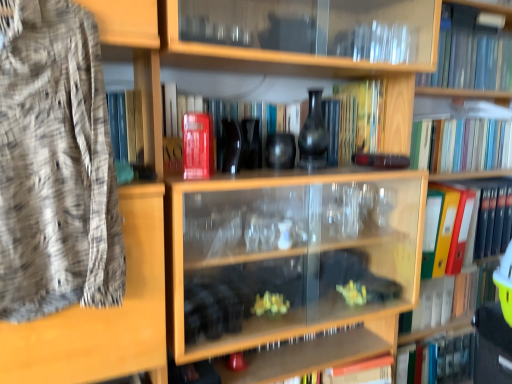
Question: Based on their positions, is yellow plastic folder at right, which is the 1th book in bottom-to-top order, located to the left or right of matte red book at center, which ranks as the 4th book in top-to-bottom order?

Choices:
 (A) right
 (B) left

Answer: (A)

Question: Is point (444, 307) closer or farther from the camera than point (163, 107)?

Choices:
 (A) closer
 (B) farther

Answer: (B)

Question: Estimate the real-world distances between objects in this image. Which object is farther from the transparent glass cabinet at lower center?

Choices:
 (A) transparent glass bookcase at upper center
 (B) matte black vase at center
 (C) orange file folder at right, the second book ordered from the bottom
 (D) yellow matte book at center, which is the 2th book from top to bottom
 (E) red matte book at upper center, the third book from the bottom

Answer: (E)

Question: Estimate the real-world distances between objects in this image. Which object is farther from the transparent glass bookcase at upper center?

Choices:
 (A) multicolored hardcover books at upper right, placed as the 5th book when sorted from bottom to top
 (B) transparent glass book at upper right, marked as the seventh book in a bottom-to-top arrangement
 (C) yellow matte book at center, the 6th book ordered from the bottom
 (D) orange file folder at right, the second book ordered from the bottom
 (E) transparent glass cabinet at lower center

Answer: (C)